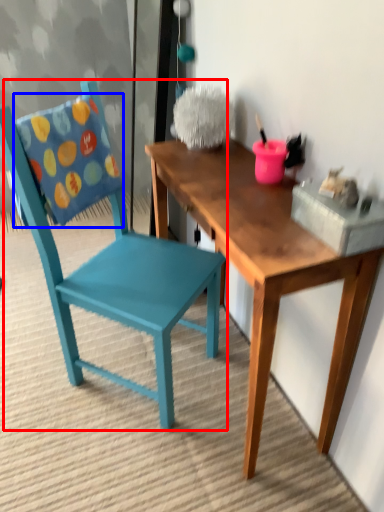
Question: Among these objects, which one is farthest to the camera, chair (highlighted by a red box) or pillow (highlighted by a blue box)?

Choices:
 (A) chair
 (B) pillow

Answer: (B)